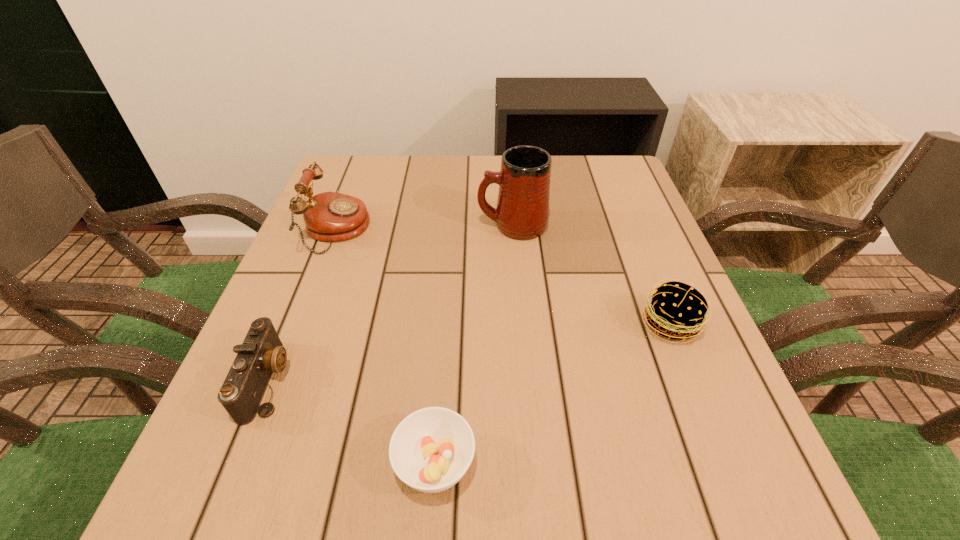
The width and height of the screenshot is (960, 540). Identify the location of the tallest object. (522, 213).

Locate an element on the screen. mug is located at coordinates (522, 213).

Find the location of a particular element. The width and height of the screenshot is (960, 540). the second tallest object is located at coordinates (330, 216).

Find the location of a particular element. the rightmost object is located at coordinates (677, 310).

At what (x,y) coordinates should I click in order to perform the action: click on camera. Please return your answer as a coordinate pair (x, y). Image resolution: width=960 pixels, height=540 pixels. Looking at the image, I should click on (261, 353).

Identify the location of the nearest object. The height and width of the screenshot is (540, 960). (431, 449).

This screenshot has height=540, width=960. Identify the location of the third object from left to right. (431, 449).

The height and width of the screenshot is (540, 960). In order to click on free space located on the side of the tallest object with the handle in this screenshot , I will do `click(456, 226)`.

Where is `free region located on the side of the tallest object with the handle`? free region located on the side of the tallest object with the handle is located at coordinates (426, 226).

Identify the location of vacant position located on the side of the tallest object with the handle. (348, 226).